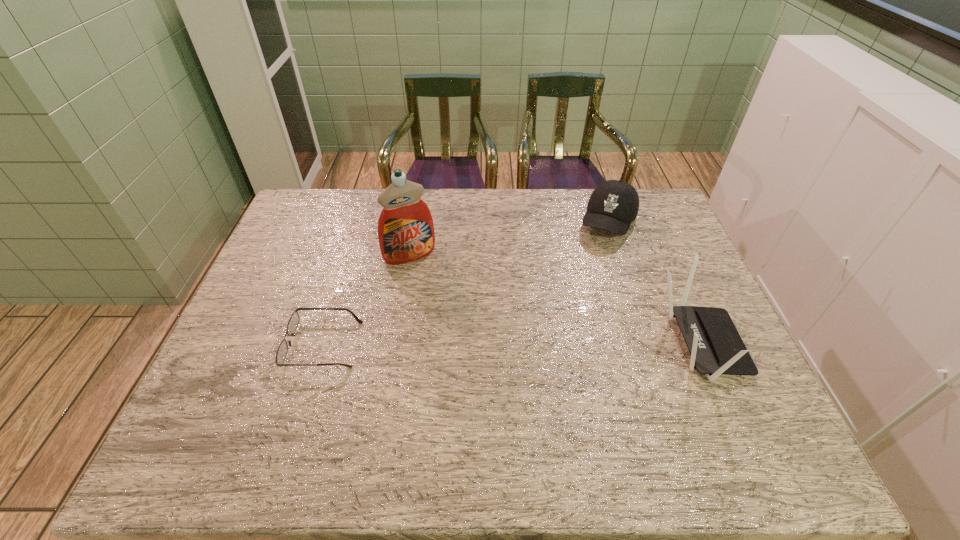
What are the coordinates of `free spot that satisfies the following two spatial constraints: 1. on the front side of the baseball cap; 2. on the front-facing side of the second tallest object` in the screenshot? It's located at (649, 344).